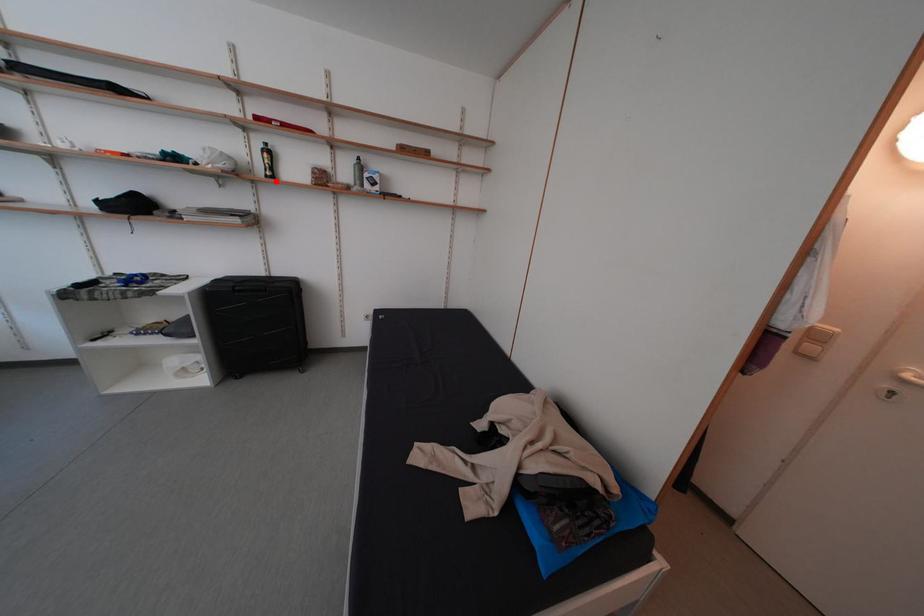
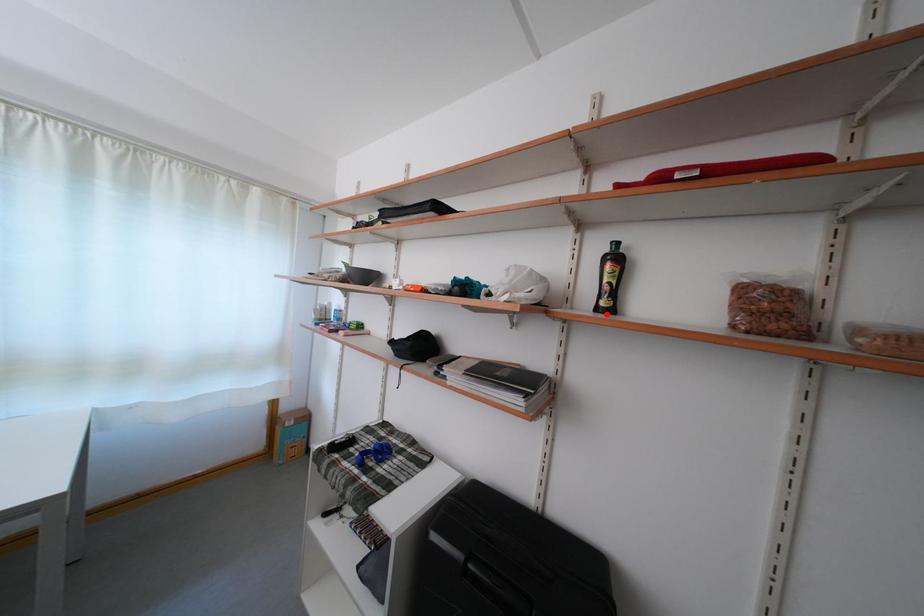
I am providing you with two images of the same scene from different viewpoints. A red point is marked on the first image and another point is marked on the second image. Does the point marked in image1 correspond to the same location as the one in image2?

Yes